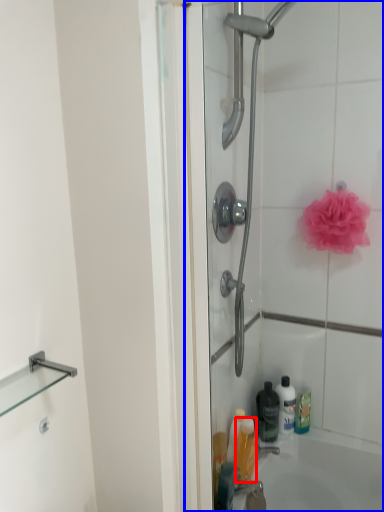
Question: Among these objects, which one is nearest to the camera, toiletry (highlighted by a red box) or shower door (highlighted by a blue box)?

Choices:
 (A) toiletry
 (B) shower door

Answer: (B)